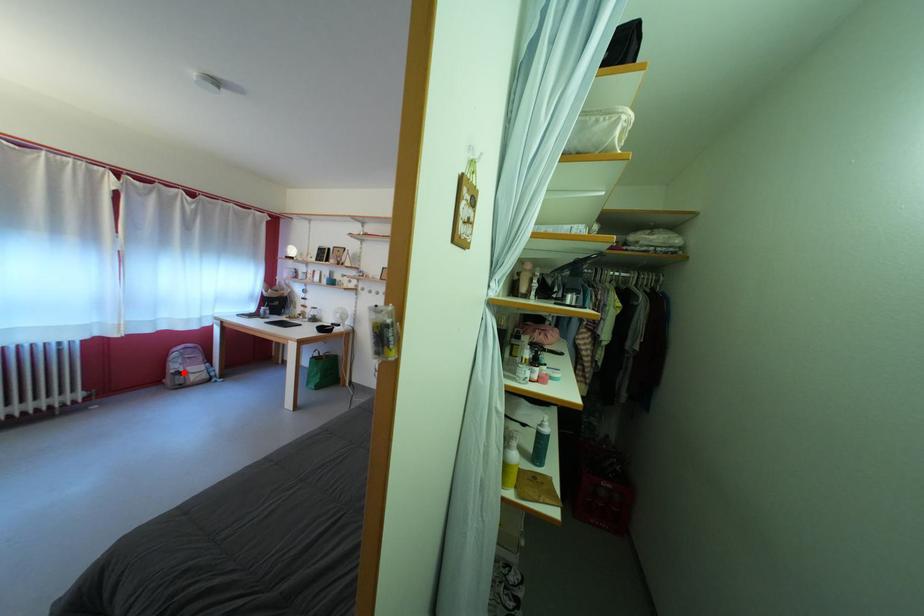
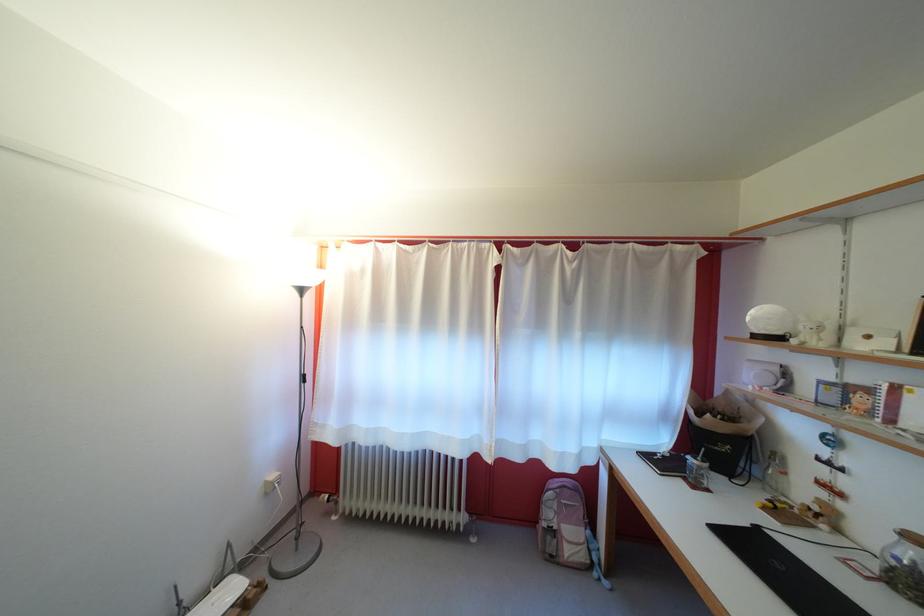
Question: I am providing you with two images of the same scene from different viewpoints. In image1, a red point is highlighted. Considering the same 3D point in image2, which of the following is correct?

Choices:
 (A) It is closer
 (B) It is farther

Answer: (B)